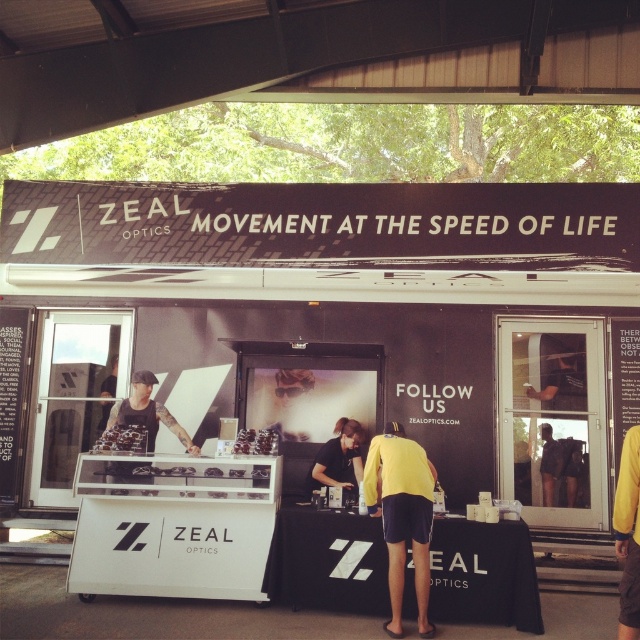
Does yellow matte shirt at center appear on the right side of black matte shirt at center?

Yes, yellow matte shirt at center is to the right of black matte shirt at center.

What do you see at coordinates (401, 515) in the screenshot? Image resolution: width=640 pixels, height=640 pixels. I see `yellow matte shirt at center` at bounding box center [401, 515].

Find the location of `yellow matte shirt at center`. yellow matte shirt at center is located at coordinates (401, 515).

Does matte black sunglasses at center have a smaller size compared to white plastic food at center?

Incorrect, matte black sunglasses at center is not smaller in size than white plastic food at center.

Which of these two, matte black sunglasses at center or white plastic food at center, stands shorter?

white plastic food at center

Which is behind, point (134, 442) or point (212, 468)?

Positioned behind is point (134, 442).

Identify the location of matte black sunglasses at center. (122, 440).

Is yellow matte shirt at center to the left of matte black sunglasses at center from the viewer's perspective?

No, yellow matte shirt at center is not to the left of matte black sunglasses at center.

Describe the element at coordinates (401, 515) in the screenshot. I see `yellow matte shirt at center` at that location.

Between point (408, 515) and point (141, 449), which one is positioned behind?

The point (141, 449) is behind.

You are a GUI agent. You are given a task and a screenshot of the screen. Output one action in this format:
    pyautogui.click(x=<x>, y=<y>)
    Task: Click on the yellow matte shirt at center
    The height and width of the screenshot is (640, 640).
    Given the screenshot: What is the action you would take?
    pyautogui.click(x=401, y=515)